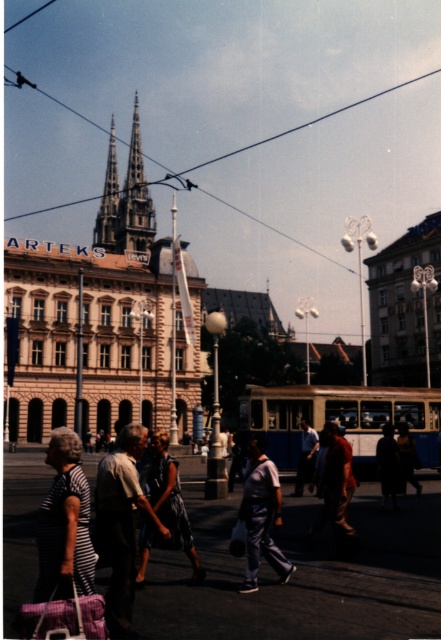
Question: Is blue denim dress at center smaller than light blue shirt at center?

Choices:
 (A) yes
 (B) no

Answer: (B)

Question: Among these points, which one is farthest from the camera?

Choices:
 (A) (357, 588)
 (B) (130, 193)
 (C) (63, 454)
 (D) (249, 554)

Answer: (B)

Question: Is striped fabric dress at lower left to the left of brown stone spire at upper center from the viewer's perspective?

Choices:
 (A) no
 (B) yes

Answer: (A)

Question: Which point is closer to the camera?

Choices:
 (A) (346, 452)
 (B) (378, 476)
 (C) (134, 246)
 (D) (280, 564)

Answer: (D)

Question: Which of the following is the farthest from the observer?

Choices:
 (A) brown stone spire at upper center
 (B) light blue shirt at center
 (C) striped fabric dress at lower left

Answer: (A)

Question: Can you confirm if blue denim dress at center is positioned below dark fabric bag at lower right?

Choices:
 (A) no
 (B) yes

Answer: (B)